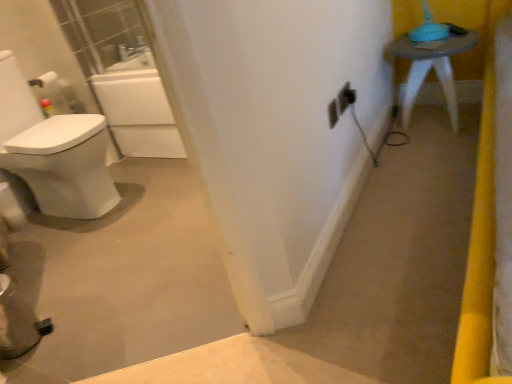
Question: From the image's perspective, is matte gray stool at upper right above matte black outlet at center-right, placed as the 1th electric outlet when sorted from right to left?

Choices:
 (A) no
 (B) yes

Answer: (B)

Question: Can you confirm if matte gray stool at upper right is positioned to the left of matte black outlet at center-right, placed as the 1th electric outlet when sorted from right to left?

Choices:
 (A) no
 (B) yes

Answer: (A)

Question: Is matte gray stool at upper right positioned in front of matte black outlet at center-right, placed as the 1th electric outlet when sorted from right to left?

Choices:
 (A) no
 (B) yes

Answer: (A)

Question: Can you confirm if matte gray stool at upper right is thinner than matte black outlet at center-right, placed as the 1th electric outlet when sorted from right to left?

Choices:
 (A) yes
 (B) no

Answer: (B)

Question: Would you say matte gray stool at upper right is outside matte black outlet at center-right, the third electric outlet positioned from the left?

Choices:
 (A) yes
 (B) no

Answer: (A)

Question: Is matte gray stool at upper right to the left or to the right of matte black outlet at center-right, placed as the 1th electric outlet when sorted from right to left, in the image?

Choices:
 (A) right
 (B) left

Answer: (A)

Question: Considering the positions of point 419,49 and point 345,89, is point 419,49 closer or farther from the camera than point 345,89?

Choices:
 (A) farther
 (B) closer

Answer: (A)

Question: Is matte gray stool at upper right wider or thinner than matte black outlet at center-right, placed as the 1th electric outlet when sorted from right to left?

Choices:
 (A) wide
 (B) thin

Answer: (A)

Question: From their relative heights in the image, would you say matte gray stool at upper right is taller or shorter than matte black outlet at center-right, placed as the 1th electric outlet when sorted from right to left?

Choices:
 (A) short
 (B) tall

Answer: (B)

Question: From a real-world perspective, is matte black outlet at center-right, placed as the 1th electric outlet when sorted from right to left, physically located above or below matte gray stool at upper right?

Choices:
 (A) below
 (B) above

Answer: (B)

Question: From the image's perspective, is matte black outlet at center-right, the third electric outlet positioned from the left, located above or below matte gray stool at upper right?

Choices:
 (A) above
 (B) below

Answer: (B)

Question: In terms of width, does matte black outlet at center-right, the third electric outlet positioned from the left, look wider or thinner when compared to matte gray stool at upper right?

Choices:
 (A) thin
 (B) wide

Answer: (A)

Question: Considering the positions of point (349, 96) and point (409, 39), is point (349, 96) closer or farther from the camera than point (409, 39)?

Choices:
 (A) closer
 (B) farther

Answer: (A)

Question: Looking at the image, does matte gray stool at upper right seem bigger or smaller compared to white plastic electric outlet at center, marked as the first electric outlet in a left-to-right arrangement?

Choices:
 (A) big
 (B) small

Answer: (A)

Question: From their relative heights in the image, would you say matte gray stool at upper right is taller or shorter than white plastic electric outlet at center, which is counted as the third electric outlet, starting from the right?

Choices:
 (A) tall
 (B) short

Answer: (A)